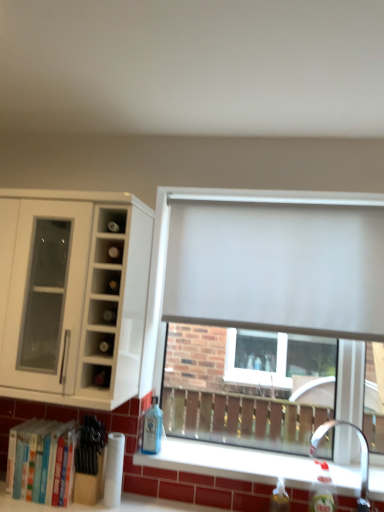
Question: Is hardcover books at lower left turned away from matte white wine rack at upper left?

Choices:
 (A) no
 (B) yes

Answer: (A)

Question: From a real-world perspective, is hardcover books at lower left positioned over matte white wine rack at upper left based on gravity?

Choices:
 (A) no
 (B) yes

Answer: (A)

Question: From a real-world perspective, is hardcover books at lower left under matte white wine rack at upper left?

Choices:
 (A) no
 (B) yes

Answer: (B)

Question: Can you confirm if hardcover books at lower left is thinner than matte white wine rack at upper left?

Choices:
 (A) yes
 (B) no

Answer: (A)

Question: Are hardcover books at lower left and matte white wine rack at upper left beside each other?

Choices:
 (A) no
 (B) yes

Answer: (A)

Question: In terms of width, does white matte cabinet at left look wider or thinner when compared to white matte window at center?

Choices:
 (A) thin
 (B) wide

Answer: (B)

Question: Looking at the image, does white matte cabinet at left seem bigger or smaller compared to white matte window at center?

Choices:
 (A) big
 (B) small

Answer: (A)

Question: Does point (74, 260) appear closer or farther from the camera than point (355, 355)?

Choices:
 (A) closer
 (B) farther

Answer: (A)

Question: From their relative heights in the image, would you say white matte cabinet at left is taller or shorter than white matte window at center?

Choices:
 (A) short
 (B) tall

Answer: (A)

Question: From a real-world perspective, is white matte curtain at center physically located above or below satin nickel faucet at lower right?

Choices:
 (A) below
 (B) above

Answer: (B)

Question: From their relative heights in the image, would you say white matte curtain at center is taller or shorter than satin nickel faucet at lower right?

Choices:
 (A) tall
 (B) short

Answer: (A)

Question: Is white matte curtain at center to the left or to the right of satin nickel faucet at lower right in the image?

Choices:
 (A) right
 (B) left

Answer: (B)

Question: In terms of size, does white matte curtain at center appear bigger or smaller than satin nickel faucet at lower right?

Choices:
 (A) small
 (B) big

Answer: (B)

Question: Is translucent plastic bottle at lower right, positioned as the second bottle in back-to-front order, to the left or to the right of blue glass bottle at lower center, positioned as the third bottle in front-to-back order, in the image?

Choices:
 (A) right
 (B) left

Answer: (A)

Question: From a real-world perspective, is translucent plastic bottle at lower right, which is the 2th bottle in front-to-back order, above or below blue glass bottle at lower center, the 3th bottle in the right-to-left sequence?

Choices:
 (A) below
 (B) above

Answer: (A)